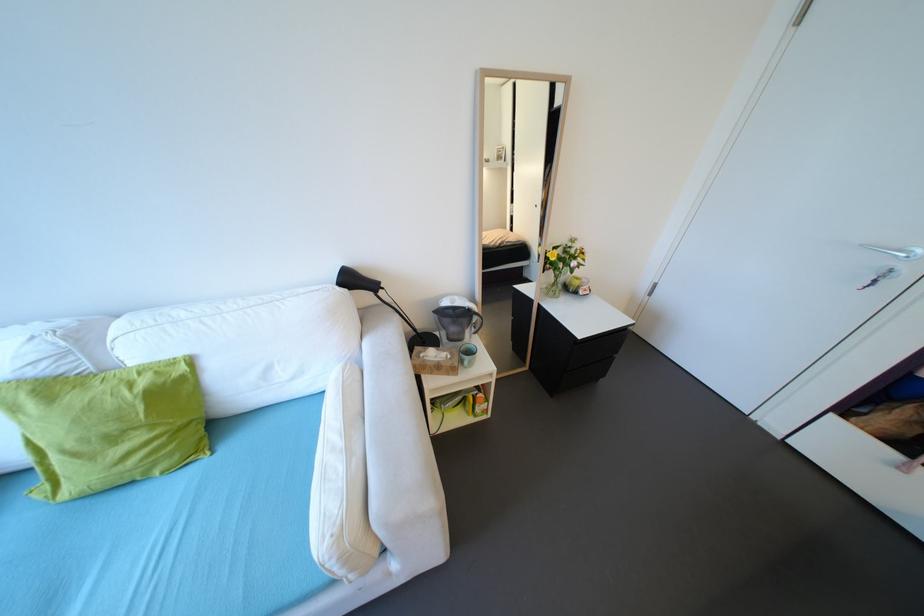
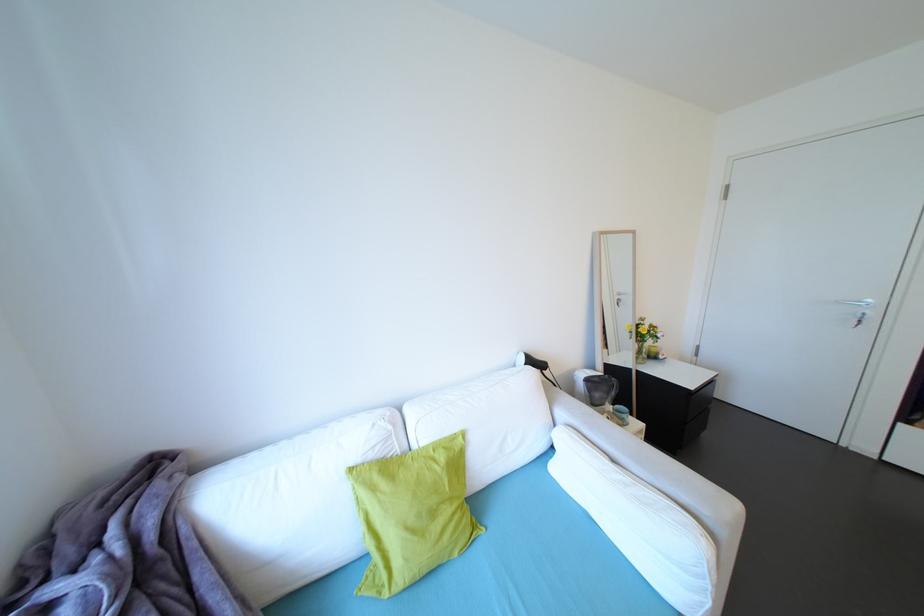
Where in the second image is the point corresponding to point (163, 373) from the first image?

(451, 448)